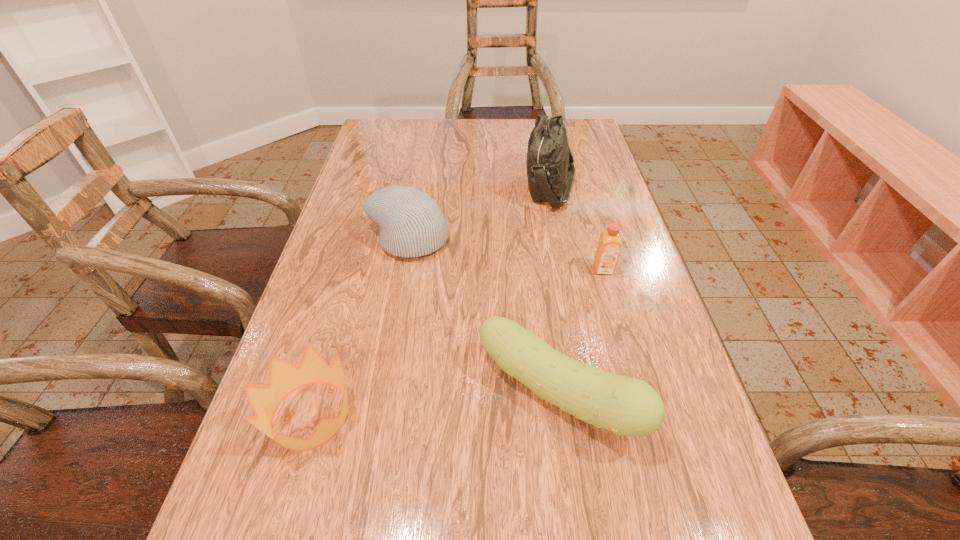
Identify the location of free location located on the front and back of the orange juice. (619, 325).

In order to click on vacant space located 0.340m on the left of the cucumber in this screenshot , I will do `click(288, 395)`.

The image size is (960, 540). I want to click on free space located 0.100m on the right of the shortest object, so click(x=416, y=415).

The image size is (960, 540). I want to click on beanie that is at the left edge, so click(x=411, y=224).

Identify the location of crown that is at the left edge. (284, 377).

Where is `shoulder bag at the right edge`? shoulder bag at the right edge is located at coordinates (550, 166).

Find the location of a particular element. The height and width of the screenshot is (540, 960). orange juice that is at the right edge is located at coordinates (610, 242).

Image resolution: width=960 pixels, height=540 pixels. Find the location of `cucumber at the right edge`. cucumber at the right edge is located at coordinates (626, 406).

You are a GUI agent. You are given a task and a screenshot of the screen. Output one action in this format:
    pyautogui.click(x=<x>, y=<y>)
    Task: Click on the blank space at the far edge of the desktop
    The width and height of the screenshot is (960, 540).
    Given the screenshot: What is the action you would take?
    (420, 140)

Find the location of a particular element. The image size is (960, 540). free space at the left edge of the desktop is located at coordinates click(x=406, y=161).